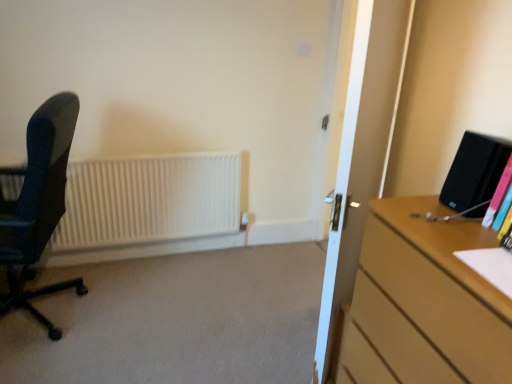
Find the location of `free space in front of white matte radiator at left`. free space in front of white matte radiator at left is located at coordinates (124, 307).